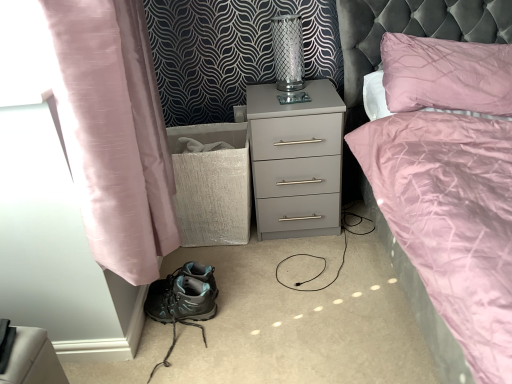
Question: Could you tell me if matte gray nightstand at center is turned towards clear glass vase at upper center?

Choices:
 (A) yes
 (B) no

Answer: (B)

Question: Are matte gray nightstand at center and clear glass vase at upper center located far from each other?

Choices:
 (A) yes
 (B) no

Answer: (B)

Question: From the image's perspective, is matte gray nightstand at center below clear glass vase at upper center?

Choices:
 (A) no
 (B) yes

Answer: (B)

Question: Does matte gray nightstand at center have a greater height compared to clear glass vase at upper center?

Choices:
 (A) no
 (B) yes

Answer: (B)

Question: Is matte gray nightstand at center touching clear glass vase at upper center?

Choices:
 (A) yes
 (B) no

Answer: (B)

Question: Can you confirm if matte gray nightstand at center is positioned to the right of clear glass vase at upper center?

Choices:
 (A) yes
 (B) no

Answer: (A)

Question: Could pink silk curtain at left be considered to be inside teal fabric hiking boots at lower left?

Choices:
 (A) no
 (B) yes

Answer: (A)

Question: Is teal fabric hiking boots at lower left thinner than pink silk curtain at left?

Choices:
 (A) yes
 (B) no

Answer: (B)

Question: Does teal fabric hiking boots at lower left turn towards pink silk curtain at left?

Choices:
 (A) no
 (B) yes

Answer: (A)

Question: Does teal fabric hiking boots at lower left touch pink silk curtain at left?

Choices:
 (A) yes
 (B) no

Answer: (B)

Question: Considering the relative sizes of teal fabric hiking boots at lower left and pink silk curtain at left in the image provided, is teal fabric hiking boots at lower left shorter than pink silk curtain at left?

Choices:
 (A) yes
 (B) no

Answer: (A)

Question: Can you confirm if teal fabric hiking boots at lower left is smaller than pink silk curtain at left?

Choices:
 (A) no
 (B) yes

Answer: (B)

Question: Is teal fabric hiking boots at lower left positioned with its back to clear glass vase at upper center?

Choices:
 (A) yes
 (B) no

Answer: (B)